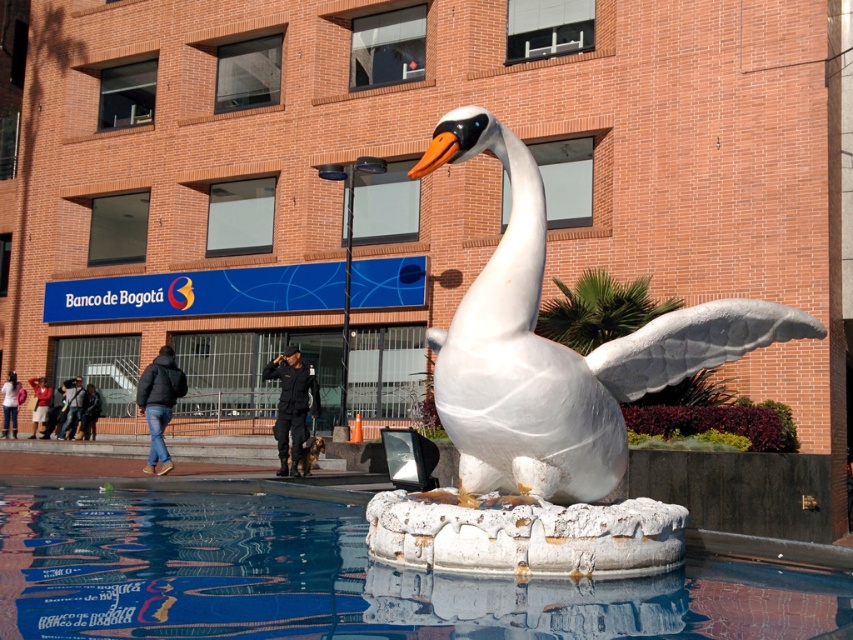
Question: Does white stone pool at center come in front of white marble swan at center?

Choices:
 (A) no
 (B) yes

Answer: (B)

Question: Which point is closer to the camera?

Choices:
 (A) (189, 540)
 (B) (596, 518)

Answer: (B)

Question: Is white stone pool at center to the left of white marble swan at center from the viewer's perspective?

Choices:
 (A) yes
 (B) no

Answer: (A)

Question: Does white stone pool at center appear over white marble swan at center?

Choices:
 (A) no
 (B) yes

Answer: (A)

Question: Which point appears farthest from the camera in this image?

Choices:
 (A) coord(641,636)
 (B) coord(538,490)

Answer: (B)